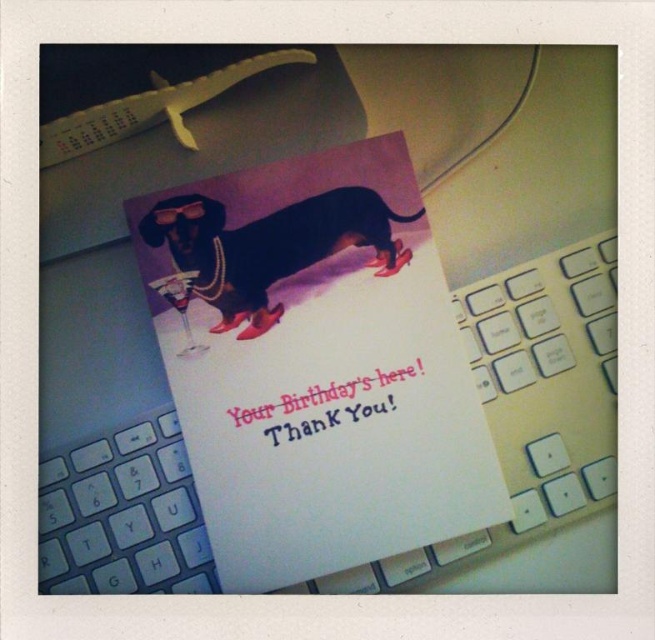
Between shiny black dog at center and pink paper text at center, which one appears on the right side from the viewer's perspective?

From the viewer's perspective, pink paper text at center appears more on the right side.

Which is below, shiny black dog at center or pink paper text at center?

pink paper text at center is below.

Does point (236, 301) lie behind point (375, 376)?

That is True.

Image resolution: width=655 pixels, height=640 pixels. In order to click on shiny black dog at center in this screenshot , I will do `click(267, 248)`.